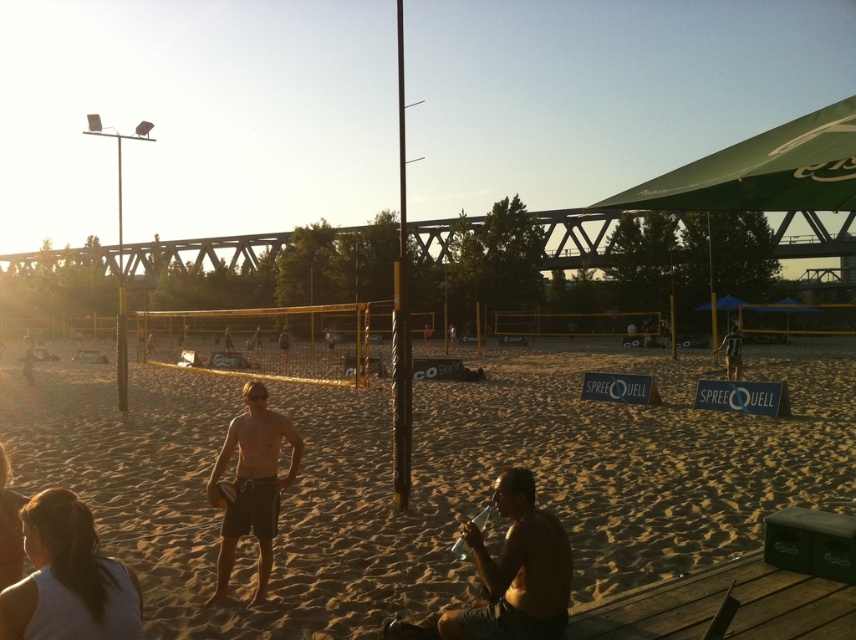
Is brown sandy beach at center further to the viewer compared to matte gray shorts at center?

No.

Which is behind, point (465, 392) or point (254, 403)?

The point (465, 392) is more distant.

Describe the element at coordinates (431, 480) in the screenshot. Image resolution: width=856 pixels, height=640 pixels. I see `brown sandy beach at center` at that location.

Image resolution: width=856 pixels, height=640 pixels. I want to click on brown sandy beach at center, so click(431, 480).

Who is taller, shiny metallic can at lower center or yellow matte volleyball at center?

Standing taller between the two is shiny metallic can at lower center.

What do you see at coordinates (516, 570) in the screenshot? The image size is (856, 640). I see `shiny metallic can at lower center` at bounding box center [516, 570].

The width and height of the screenshot is (856, 640). I want to click on shiny metallic can at lower center, so tap(516, 570).

Is light brown wooden pole at center closer to camera compared to yellow matte volleyball at center?

No, it is behind yellow matte volleyball at center.

Is point (732, 333) in front of point (217, 490)?

That is False.

Where is `light brown wooden pole at center`? Image resolution: width=856 pixels, height=640 pixels. light brown wooden pole at center is located at coordinates (730, 353).